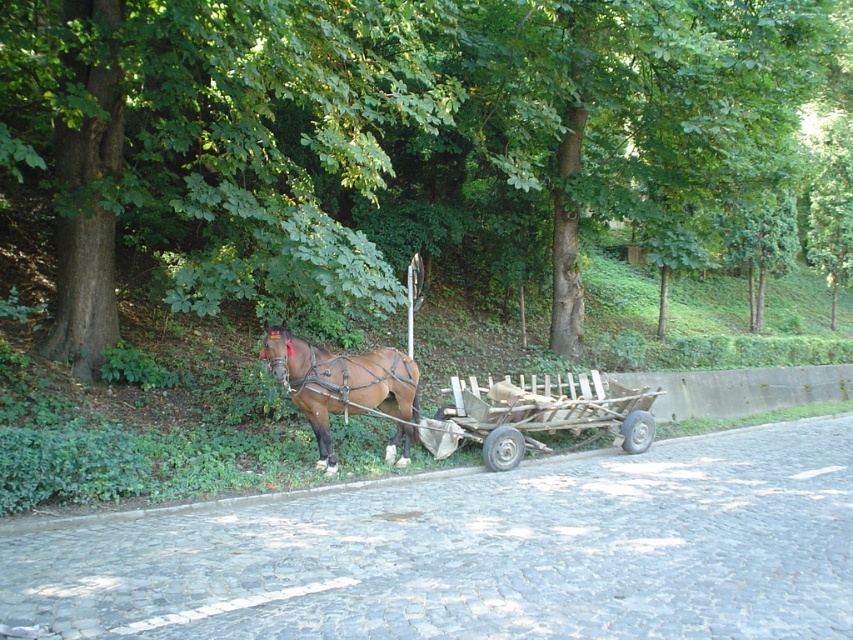
Is brown wood tree at upper left below brown glossy horse at center?

No, brown wood tree at upper left is not below brown glossy horse at center.

Which of these two, brown wood tree at upper left or brown glossy horse at center, stands taller?

brown wood tree at upper left

Consider the image. Who is more distant from viewer, (299, 173) or (379, 388)?

Positioned behind is point (299, 173).

This screenshot has width=853, height=640. I want to click on brown wood tree at upper left, so [390, 134].

Can you confirm if brown wood tree at upper left is smaller than wooden planks cart at lower right?

Incorrect, brown wood tree at upper left is not smaller in size than wooden planks cart at lower right.

Can you confirm if brown wood tree at upper left is positioned to the right of wooden planks cart at lower right?

Indeed, brown wood tree at upper left is positioned on the right side of wooden planks cart at lower right.

Which is in front, point (392, 140) or point (573, 406)?

Point (573, 406)

Locate an element on the screen. brown wood tree at upper left is located at coordinates pyautogui.click(x=390, y=134).

Is the position of wooden planks cart at lower right more distant than that of brown glossy horse at center?

Yes, wooden planks cart at lower right is further from the viewer.

Is the position of wooden planks cart at lower right less distant than that of brown glossy horse at center?

No, it is not.

Based on the photo, who is more distant from viewer, (575, 416) or (322, 397)?

The point (575, 416) is more distant.

Locate an element on the screen. The image size is (853, 640). wooden planks cart at lower right is located at coordinates (544, 412).